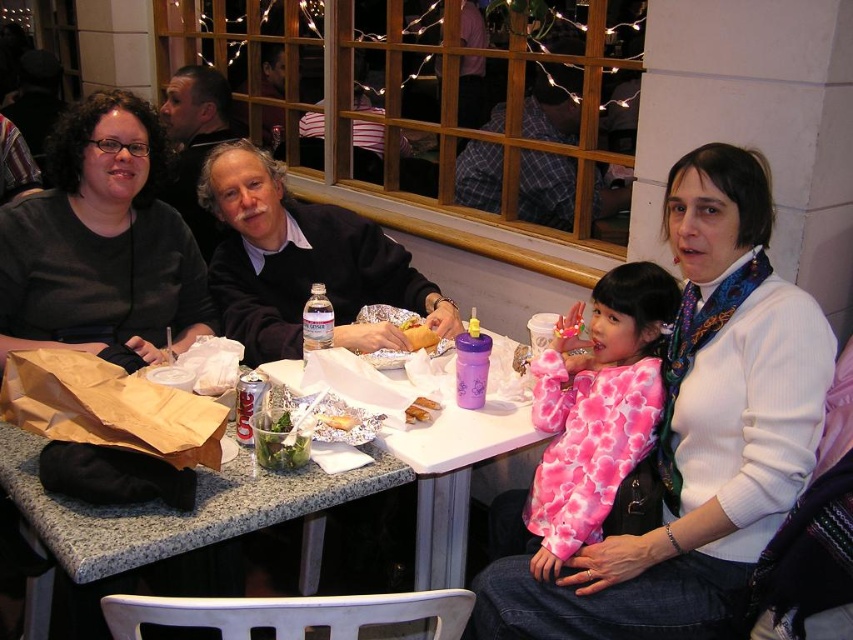
Question: Is white sweater at center to the left of gray knit sweater at center from the viewer's perspective?

Choices:
 (A) no
 (B) yes

Answer: (A)

Question: Which object is positioned farthest from the plaid shirt at center?

Choices:
 (A) white sweater at center
 (B) matte plastic sandwich at center
 (C) dark brown sweater at center

Answer: (A)

Question: Can you confirm if plaid shirt at center is bigger than gray knit sweater at center?

Choices:
 (A) yes
 (B) no

Answer: (A)

Question: Does pink tie-dye sweater at center have a greater width compared to plaid shirt at center?

Choices:
 (A) no
 (B) yes

Answer: (A)

Question: Which object is the farthest from the matte black shirt at left?

Choices:
 (A) gray knit sweater at center
 (B) dark brown sweater at center
 (C) matte plastic sandwich at center
 (D) white sweater at center

Answer: (D)

Question: Which point is farther to the camera?

Choices:
 (A) (165, 198)
 (B) (722, 385)
 (C) (405, 336)

Answer: (A)